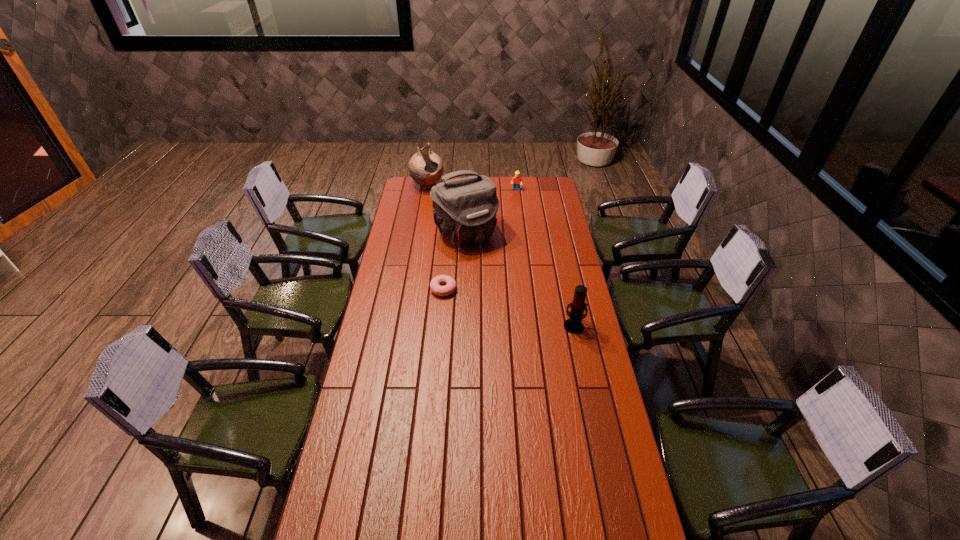
The image size is (960, 540). What are the coordinates of `the second nearest object` in the screenshot? It's located at (450, 284).

Find the location of a particular element. This screenshot has width=960, height=540. doughnut is located at coordinates (450, 284).

This screenshot has height=540, width=960. Find the location of `microphone`. microphone is located at coordinates (573, 325).

Where is `the rightmost object`? the rightmost object is located at coordinates (573, 325).

You are a GUI agent. You are given a task and a screenshot of the screen. Output one action in this format:
    pyautogui.click(x=<x>, y=<y>)
    Task: Click on the tallest object
    The height and width of the screenshot is (540, 960).
    Given the screenshot: What is the action you would take?
    (x=465, y=209)

Image resolution: width=960 pixels, height=540 pixels. I want to click on shoulder bag, so [x=465, y=209].

You are a GUI agent. You are given a task and a screenshot of the screen. Output one action in this format:
    pyautogui.click(x=<x>, y=<y>)
    Task: Click on the second shortest object
    The height and width of the screenshot is (540, 960).
    Given the screenshot: What is the action you would take?
    pyautogui.click(x=517, y=180)

I want to click on Lego, so click(x=517, y=180).

Where is `pottery`? The image size is (960, 540). pottery is located at coordinates (425, 167).

This screenshot has height=540, width=960. I want to click on free space located 0.200m on the back of the shortest object, so click(446, 253).